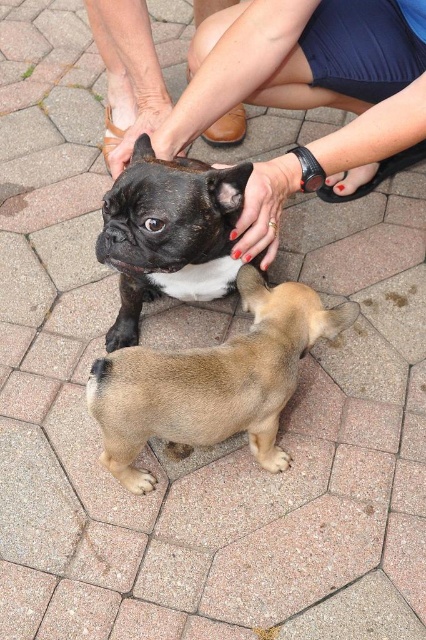
You are a photographer trying to capture a closeup shot of both the smooth tan dog at center and the shiny black fur at center. Given their current positions, can you fit both subjects into a single frame without moving either dog?

The smooth tan dog at center is only 23.46 centimeters away from the shiny black fur at center, so yes, both subjects can be captured in a single frame without moving them as the distance between them is relatively small.

You are standing in front of the two French Bulldogs in the image. You want to throw a treat to the closer point between point (x=215, y=376) and point (x=121, y=344). Which point should you aim for?

Point (x=215, y=376) is closer to the camera than point (x=121, y=344), so you should aim for point (x=215, y=376) to throw the treat.

You are a photographer trying to capture a group photo of the smooth black dog at center and the smooth tan dog at center. Which dog should you move to the left to ensure both are centered in the frame?

You should move the smooth black dog at center to the left since it is currently positioned on the right side of the smooth tan dog at center, so moving it left would help center both dogs in the frame.